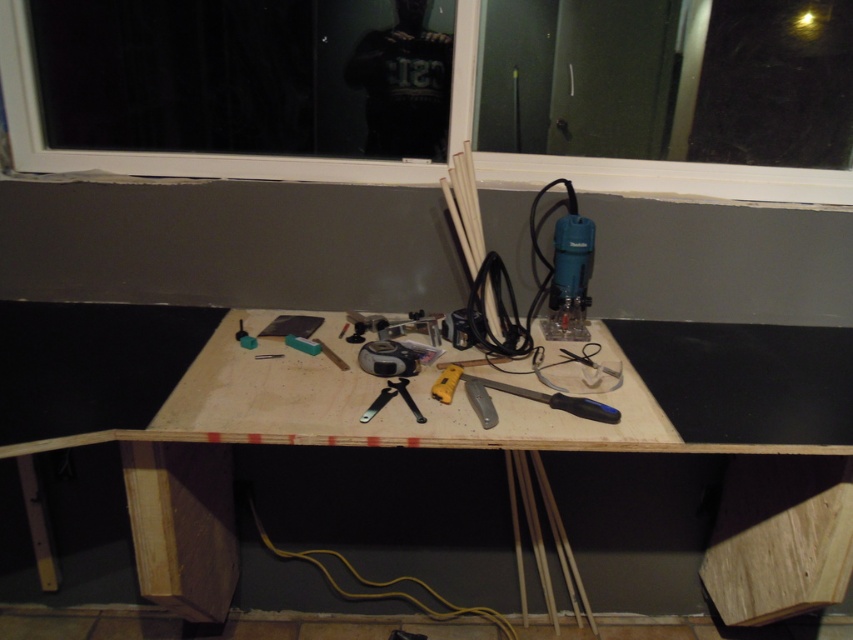
Question: Considering the real-world distances, which object is farthest from the plywood table at center?

Choices:
 (A) blue plastic saw at center
 (B) transparent glass window at upper center

Answer: (B)

Question: Is plywood table at center above blue plastic saw at center?

Choices:
 (A) yes
 (B) no

Answer: (B)

Question: Considering the relative positions of transparent glass window at upper center and blue plastic saw at center in the image provided, where is transparent glass window at upper center located with respect to blue plastic saw at center?

Choices:
 (A) right
 (B) left

Answer: (B)

Question: Estimate the real-world distances between objects in this image. Which object is closer to the transparent glass window at upper center?

Choices:
 (A) plywood table at center
 (B) blue plastic saw at center

Answer: (B)

Question: Can you confirm if plywood table at center is positioned above transparent glass window at upper center?

Choices:
 (A) no
 (B) yes

Answer: (A)

Question: Which point is closer to the camera taking this photo?

Choices:
 (A) (608, 420)
 (B) (427, 454)

Answer: (A)